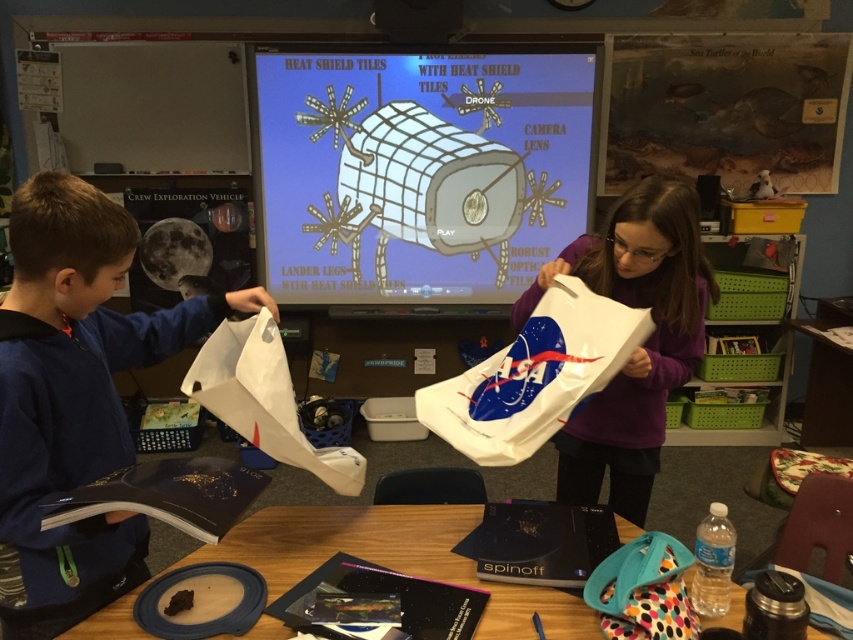
Question: In this image, where is white fabric shirt at center located relative to wooden table at lower center?

Choices:
 (A) below
 (B) above

Answer: (B)

Question: In this image, where is white glossy screen at upper center located relative to white fabric shirt at center?

Choices:
 (A) above
 (B) below

Answer: (A)

Question: Which of the following is the closest to the observer?

Choices:
 (A) white glossy screen at upper center
 (B) wooden table at lower center
 (C) white fabric shirt at center

Answer: (B)

Question: Among these points, which one is farthest from the camera?

Choices:
 (A) (271, 68)
 (B) (631, 396)
 (C) (47, 252)
 (D) (265, 522)

Answer: (A)

Question: Which object is positioned farthest from the blue fabric book at left?

Choices:
 (A) white fabric shirt at center
 (B) wooden table at lower center

Answer: (A)

Question: Is the position of blue fabric book at left less distant than that of white fabric shirt at center?

Choices:
 (A) no
 (B) yes

Answer: (B)